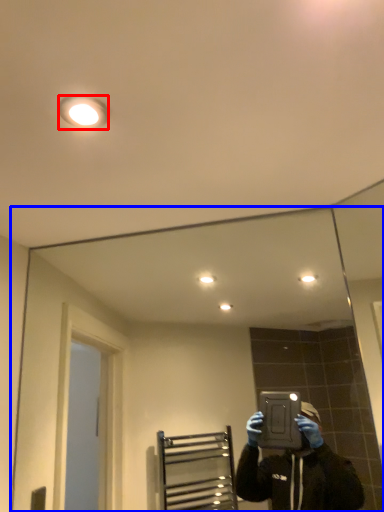
Question: Which point is closer to the camera, light fixture (highlighted by a red box) or mirror (highlighted by a blue box)?

Choices:
 (A) light fixture
 (B) mirror

Answer: (A)